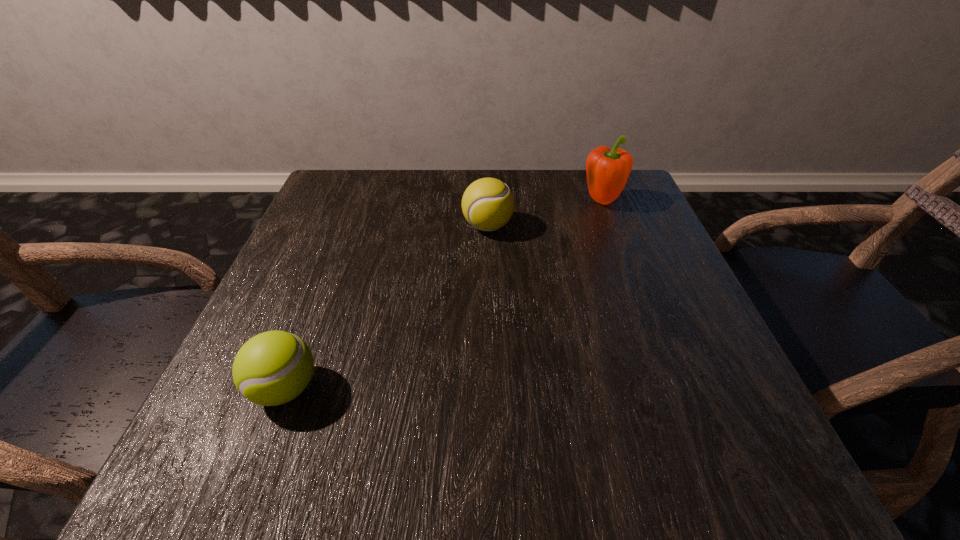
This screenshot has width=960, height=540. I want to click on the closest object to the second object from left to right, so click(x=607, y=170).

Where is `object identified as the closest to the nearest object`? The width and height of the screenshot is (960, 540). object identified as the closest to the nearest object is located at coordinates (487, 204).

This screenshot has height=540, width=960. In order to click on free space that satisfies the following two spatial constraints: 1. on the back side of the second object from right to left; 2. on the right side of the left tennis ball in this screenshot , I will do `click(348, 226)`.

The image size is (960, 540). I want to click on free spot that satisfies the following two spatial constraints: 1. on the back side of the rightmost object; 2. on the right side of the farther tennis ball, so click(487, 202).

Locate an element on the screen. This screenshot has height=540, width=960. vacant region that satisfies the following two spatial constraints: 1. on the back side of the right tennis ball; 2. on the left side of the pepper is located at coordinates (487, 202).